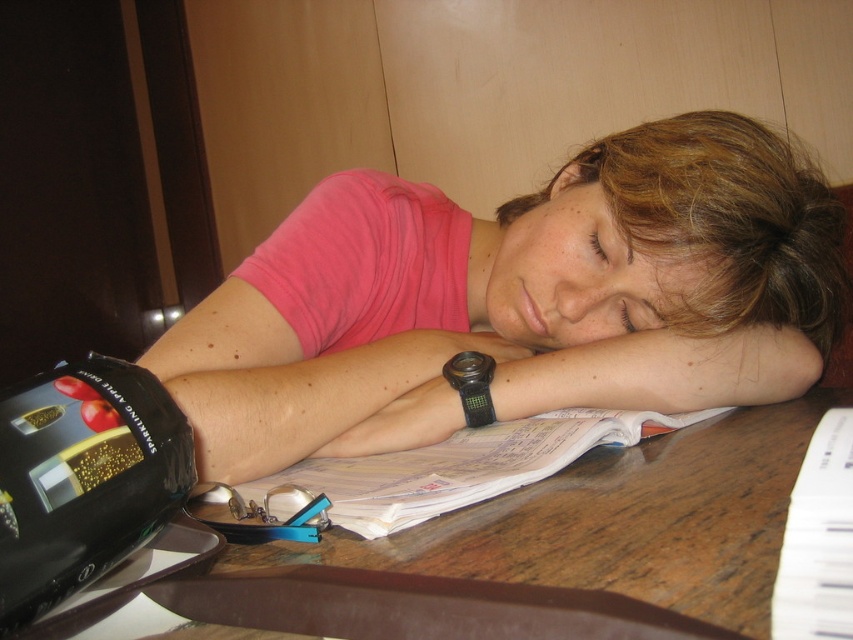
Question: Is pink fabric shirt at center closer to the viewer compared to brown hair at center?

Choices:
 (A) yes
 (B) no

Answer: (A)

Question: Which object appears closest to the camera in this image?

Choices:
 (A) brown hair at center
 (B) pink fabric shirt at center

Answer: (B)

Question: Which object is farther from the camera taking this photo?

Choices:
 (A) brown hair at center
 (B) pink fabric shirt at center

Answer: (A)

Question: Which object appears closest to the camera in this image?

Choices:
 (A) brown hair at center
 (B) pink fabric shirt at center

Answer: (B)

Question: Considering the relative positions of pink fabric shirt at center and brown hair at center in the image provided, where is pink fabric shirt at center located with respect to brown hair at center?

Choices:
 (A) right
 (B) left

Answer: (B)

Question: Does pink fabric shirt at center lie behind brown hair at center?

Choices:
 (A) yes
 (B) no

Answer: (B)